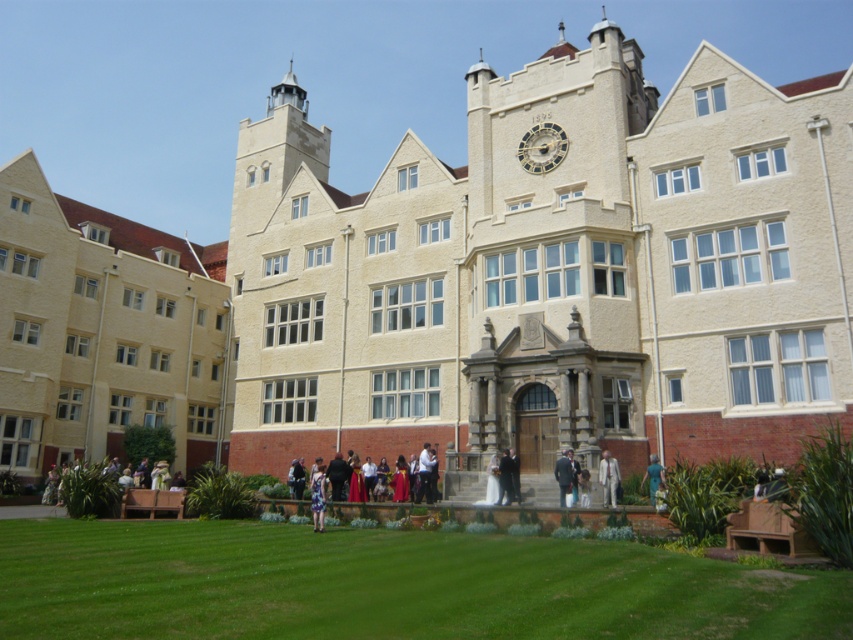
Is gold-toned metal clock at upper center to the left of light gray suit at center from the viewer's perspective?

Indeed, gold-toned metal clock at upper center is positioned on the left side of light gray suit at center.

Does point (538, 134) lie in front of point (613, 467)?

That is False.

At what (x,y) coordinates should I click in order to perform the action: click on gold-toned metal clock at upper center. Please return your answer as a coordinate pair (x, y). Looking at the image, I should click on (543, 147).

Find the location of a particular element. gold-toned metal clock at upper center is located at coordinates (543, 147).

In the scene shown: Does light gray suit at center have a lesser height compared to matte blue dress at center?

Incorrect, light gray suit at center's height does not fall short of matte blue dress at center's.

Between point (611, 477) and point (657, 460), which one is positioned in front?

Point (611, 477)

This screenshot has width=853, height=640. What are the coordinates of `light gray suit at center` in the screenshot? It's located at (608, 477).

Does green grass at lower center have a greater height compared to light gray suit at center?

In fact, green grass at lower center may be shorter than light gray suit at center.

Which of these two, green grass at lower center or light gray suit at center, stands taller?

light gray suit at center is taller.

Locate an element on the screen. This screenshot has width=853, height=640. green grass at lower center is located at coordinates (387, 586).